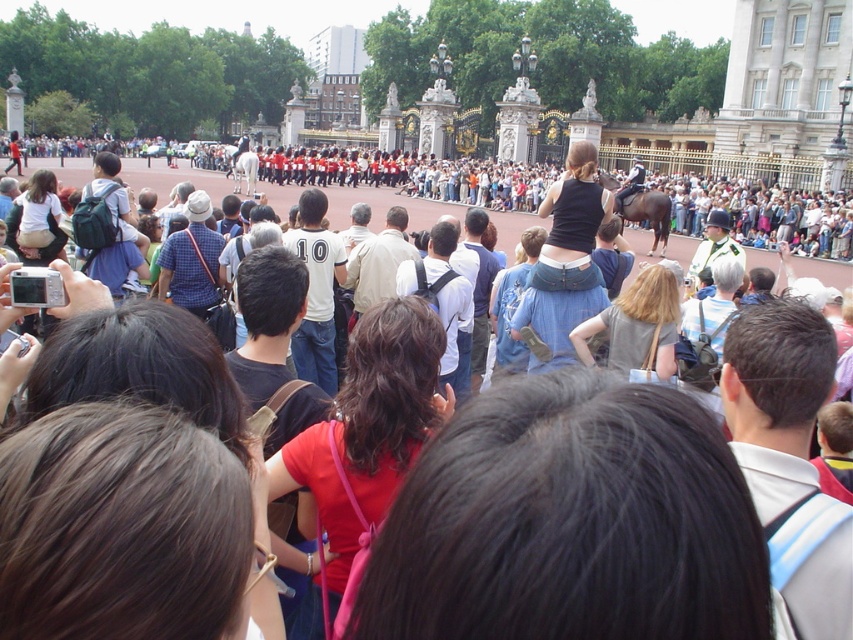
Question: Is gray fabric shirt at center wider than matte white shirt at center?

Choices:
 (A) yes
 (B) no

Answer: (B)

Question: Which point is closer to the camera?

Choices:
 (A) (415, 344)
 (B) (581, 342)

Answer: (A)

Question: Considering the relative positions of matte red shirt at center and matte white shirt at center in the image provided, where is matte red shirt at center located with respect to matte white shirt at center?

Choices:
 (A) right
 (B) left

Answer: (A)

Question: Does matte red shirt at center appear under matte white shirt at center?

Choices:
 (A) no
 (B) yes

Answer: (B)

Question: Which of the following is the closest to the observer?

Choices:
 (A) (637, 284)
 (B) (32, 246)

Answer: (A)

Question: Among these points, which one is nearest to the camera?

Choices:
 (A) (318, 634)
 (B) (50, 212)

Answer: (A)